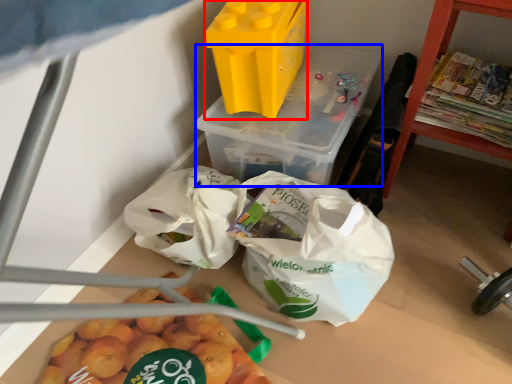
Question: Which object is closer to the camera taking this photo, yoghurt (highlighted by a red box) or yoghurt (highlighted by a blue box)?

Choices:
 (A) yoghurt
 (B) yoghurt

Answer: (A)